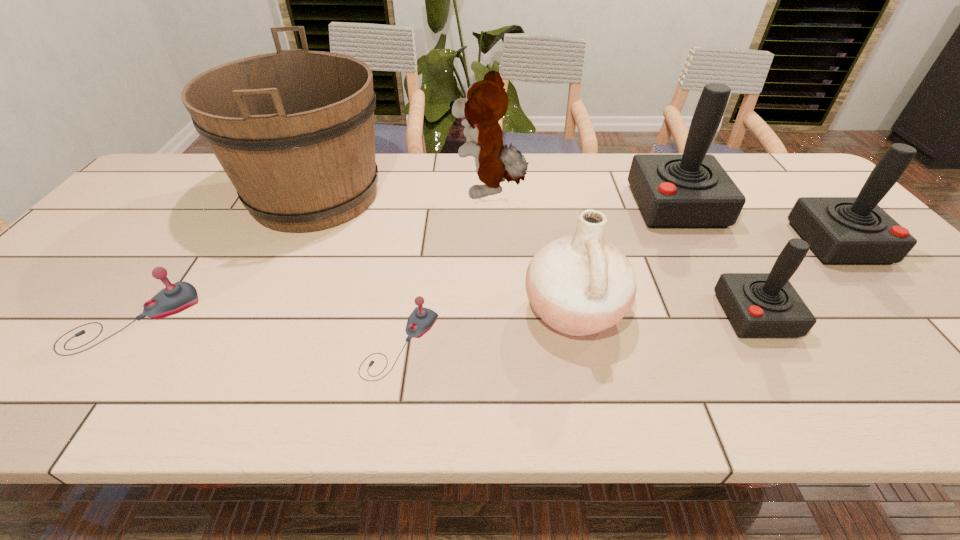
The height and width of the screenshot is (540, 960). What are the coordinates of `the second closest red joystick to the brown puppy` in the screenshot? It's located at [757, 304].

Locate which red joystick is the third closest to the seventh tallest object. Please provide its 2D coordinates. Your answer should be formatted as a tuple, i.e. [(x, y)], where the tuple contains the x and y coordinates of a point satisfying the conditions above.

[(840, 230)]

Locate an element on the screen. free space in the image that satisfies the following two spatial constraints: 1. on the front side of the third object from left to right; 2. on the left side of the leftmost joystick is located at coordinates (115, 344).

The image size is (960, 540). What are the coordinates of `free space that satisfies the following two spatial constraints: 1. on the base of the rightmost object; 2. on the base of the smallest red joystick` in the screenshot? It's located at (902, 315).

The height and width of the screenshot is (540, 960). Identify the location of free point that satisfies the following two spatial constraints: 1. to pour from the handle of the reddish-brown pottery; 2. on the front side of the shortest object. (581, 344).

Locate an element on the screen. This screenshot has width=960, height=540. free point that satisfies the following two spatial constraints: 1. on the face of the puppy; 2. on the front side of the shortest object is located at coordinates (493, 344).